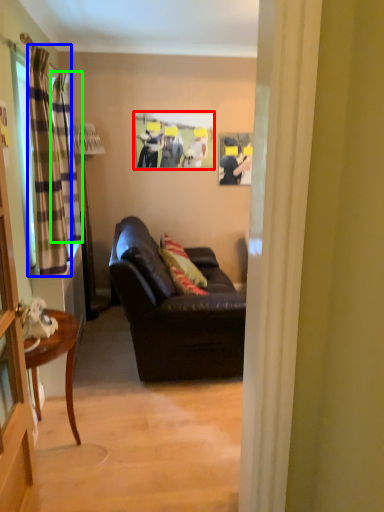
Question: Considering the real-world distances, which object is closest to picture frame (highlighted by a red box)? curtain (highlighted by a blue box) or curtain (highlighted by a green box).

Choices:
 (A) curtain
 (B) curtain

Answer: (B)